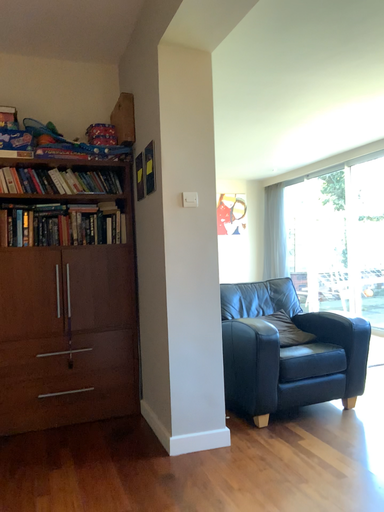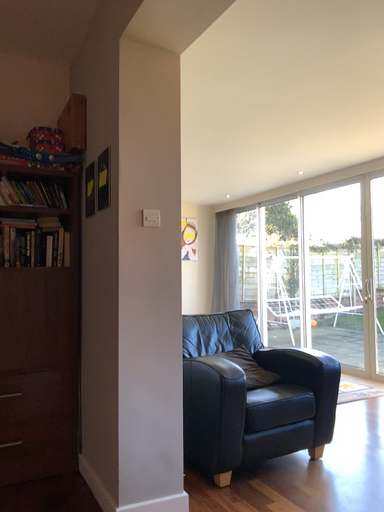
Question: How did the camera likely rotate when shooting the video?

Choices:
 (A) rotated right
 (B) rotated left

Answer: (A)